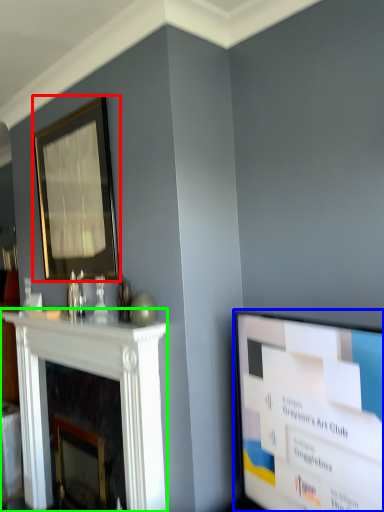
Question: Which is nearer to the picture frame (highlighted by a red box)? television (highlighted by a blue box) or fireplace (highlighted by a green box).

Choices:
 (A) television
 (B) fireplace

Answer: (B)